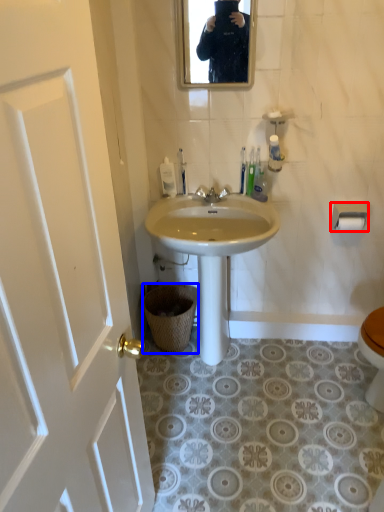
Question: Which of the following is the farthest to the observer, toilet paper (highlighted by a red box) or trash bin/can (highlighted by a blue box)?

Choices:
 (A) toilet paper
 (B) trash bin/can

Answer: (B)